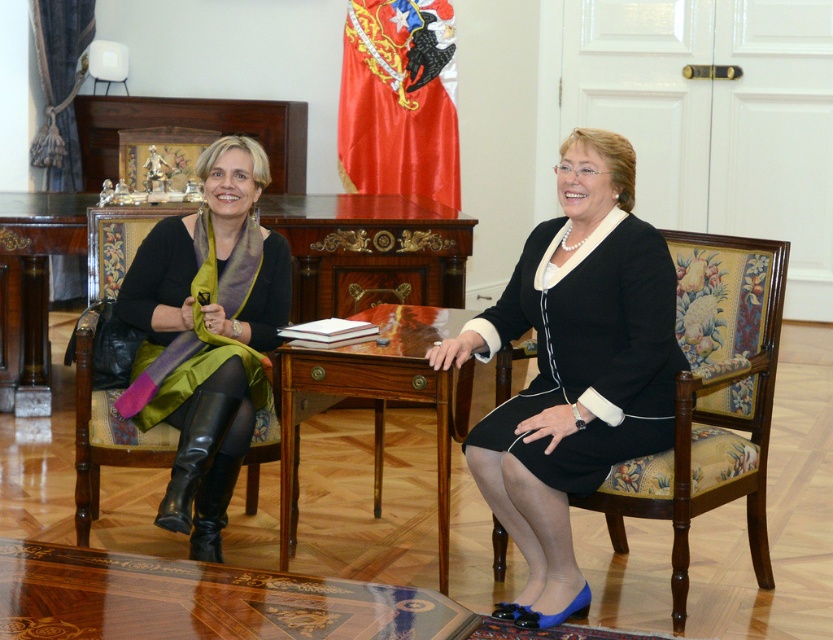
You are a photographer setting up for a formal event. You need to ensure that the black satin dress at center and the velvet green chair at left are both visible in the frame. Given their height difference, which object will appear larger in the photo?

The black satin dress at center will appear larger in the photo because it is much taller than the velvet green chair at left.

Looking at this image, you are standing in the middle of the room and want to place a document on the glossy wood table at center. Based on the room layout, can you determine if you need to move forward, backward, or sideways to reach it?

The glossy wood table at center is located at point [385,400] in 2D coordinates, so you would need to move forward from your current position in the middle of the room to reach it.